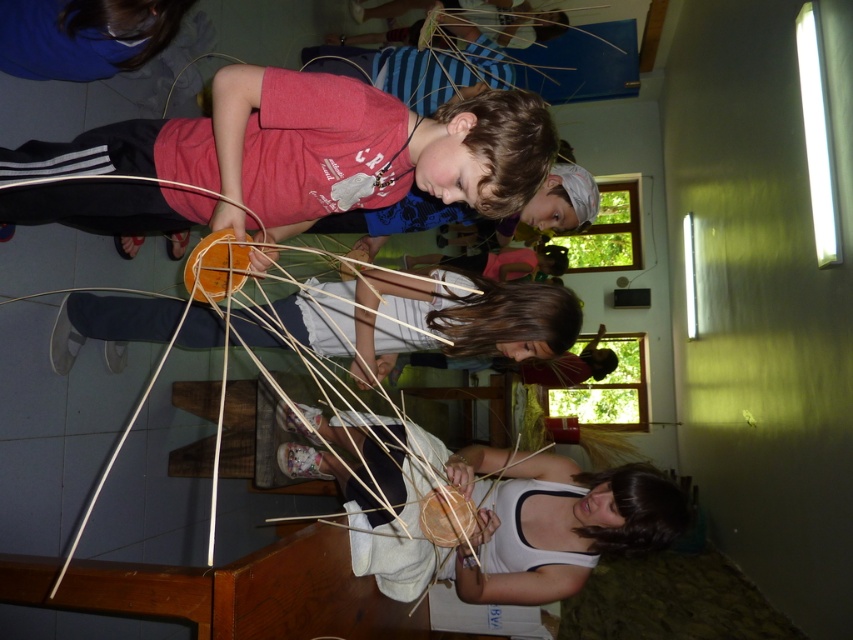
You are standing at the point marked as point (390, 573) and want to move towards the door located at the far end of the room. Is there enough space to walk straight to the door without any obstacles?

The distance between point (390, 573) and the viewer is 1.85 meters. Since the door is at the far end of the room, there should be enough space to walk straight to the door without obstacles, assuming no other objects are blocking the path.

You are a child participating in the weaving activity and need to place your finished basket into the natural straw basket at lower center. Based on the coordinates provided, can you determine the exact location where you should place your basket?

The natural straw basket at lower center is located at coordinates point (480,509), so you should place your finished basket there.